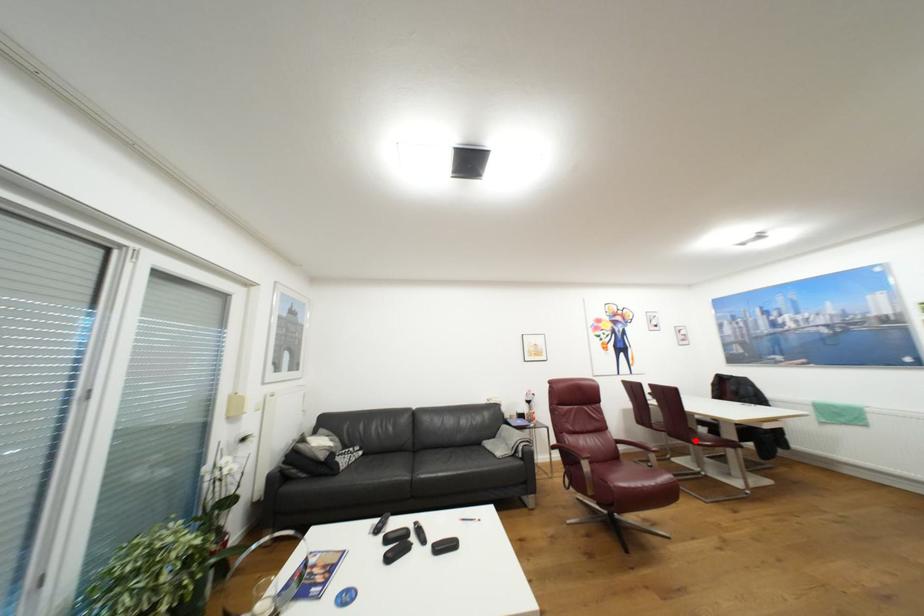
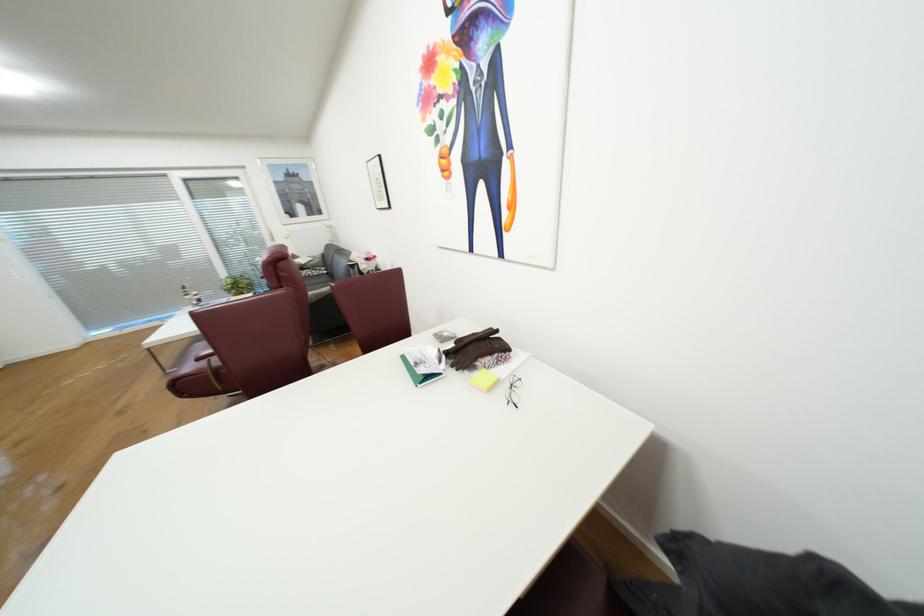
Question: I am providing you with two images of the same scene from different viewpoints. A red point is marked on the first image. Is the red point's position out of view in image 2?

Choices:
 (A) Yes
 (B) No

Answer: (A)